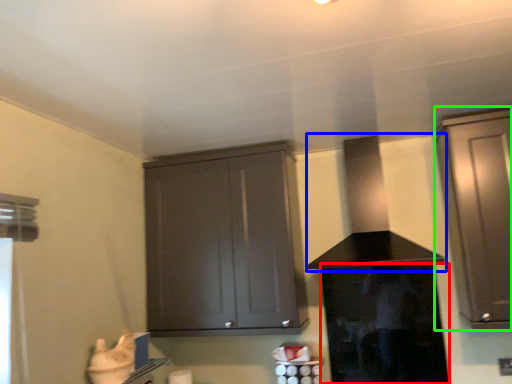
Question: Which object is the farthest from screen door (highlighted by a red box)? Choose among these: vent (highlighted by a blue box) or cabinetry (highlighted by a green box).

Choices:
 (A) vent
 (B) cabinetry

Answer: (B)